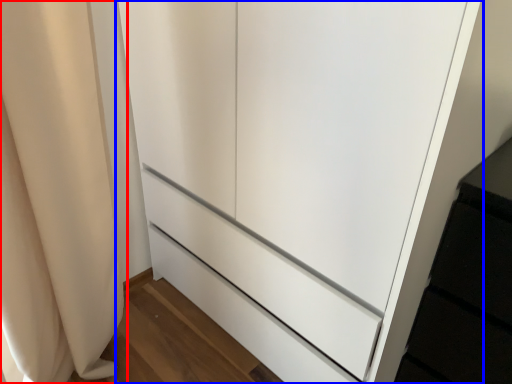
Question: Which point is further to the camera, curtain (highlighted by a red box) or cupboard (highlighted by a blue box)?

Choices:
 (A) curtain
 (B) cupboard

Answer: (A)